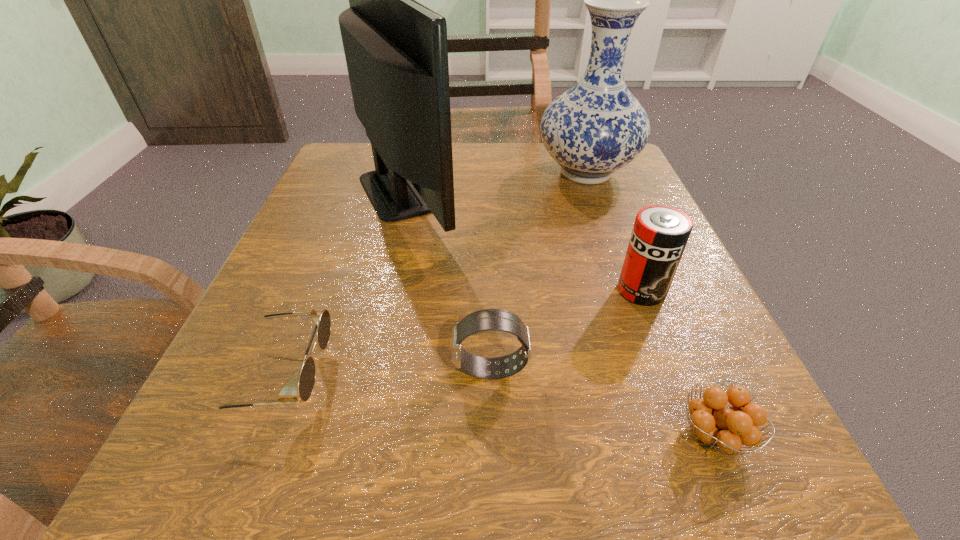
The width and height of the screenshot is (960, 540). I want to click on vacant point at the right edge, so click(689, 267).

Where is `blank space at the far left corner`? The height and width of the screenshot is (540, 960). blank space at the far left corner is located at coordinates (362, 195).

At what (x,y) coordinates should I click in order to perform the action: click on free space at the near right corner. Please return your answer as a coordinate pair (x, y). The width and height of the screenshot is (960, 540). Looking at the image, I should click on (638, 437).

You are a GUI agent. You are given a task and a screenshot of the screen. Output one action in this format:
    pyautogui.click(x=<x>, y=<y>)
    Task: Click on the vacant space that's between the third object from left to right and the vase
    
    Given the screenshot: What is the action you would take?
    pyautogui.click(x=539, y=271)

At what (x,y) coordinates should I click in order to perform the action: click on vacant region between the fourth tallest object and the vase. Please return your answer as a coordinate pair (x, y). Looking at the image, I should click on (539, 271).

What are the coordinates of `free spot between the orange fruit and the third farthest object` in the screenshot? It's located at (678, 363).

The height and width of the screenshot is (540, 960). In order to click on free spot between the fourth object from right to left and the vase in this screenshot , I will do `click(539, 271)`.

Where is `empty space between the third shortest object and the orange fruit`? empty space between the third shortest object and the orange fruit is located at coordinates click(x=602, y=402).

The height and width of the screenshot is (540, 960). Find the location of `vacant area between the sunglasses and the fourth tallest object`. vacant area between the sunglasses and the fourth tallest object is located at coordinates (384, 372).

The height and width of the screenshot is (540, 960). What are the coordinates of `free space between the computer monitor and the third object from left to right` in the screenshot? It's located at (448, 280).